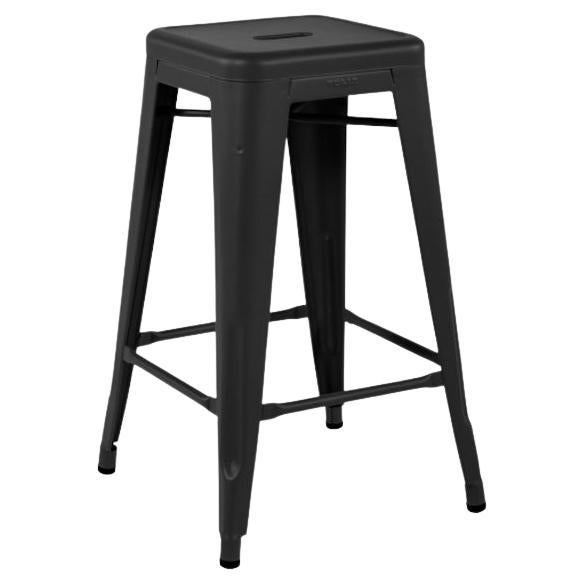
You are a GUI agent. You are given a task and a screenshot of the screen. Output one action in this format:
    pyautogui.click(x=<x>, y=<y>)
    Task: Click on the stool legs
    
    Given the screenshot: What is the action you would take?
    [245, 357], [131, 312], [318, 325], [458, 402]